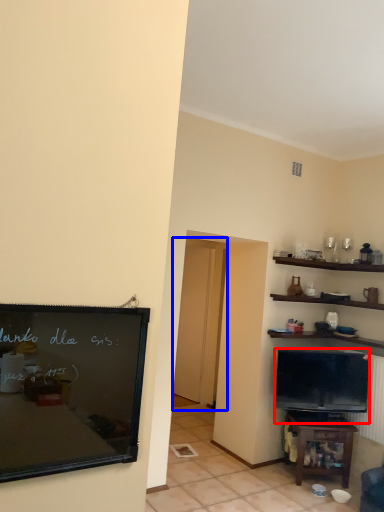
Question: Which of the following is the closest to the observer, television (highlighted by a red box) or glass door (highlighted by a blue box)?

Choices:
 (A) television
 (B) glass door

Answer: (A)